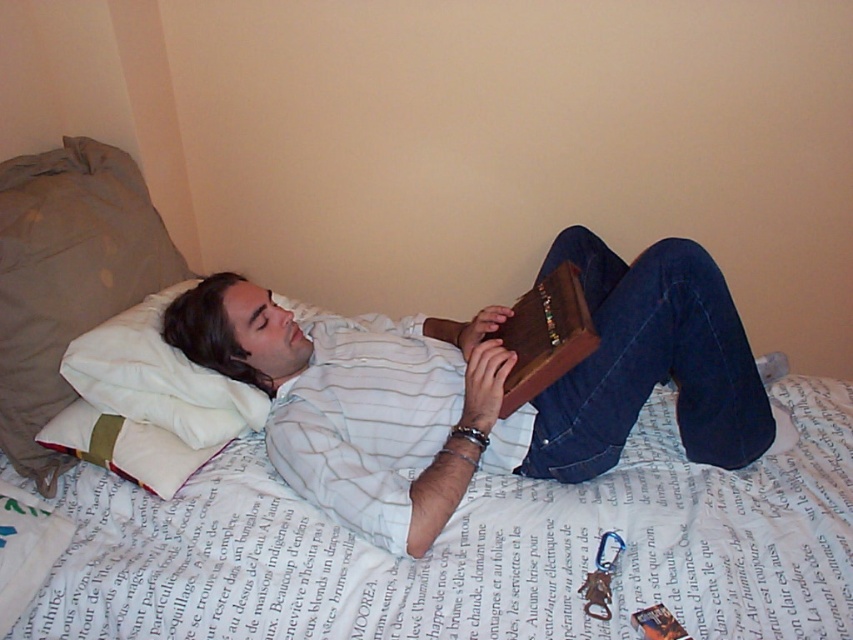
You are a photographer setting up a shot of the scene. You need to position a light source to the left of the white soft pillow at upper left so that it illuminates the matte brown book at center. Based on their positions, will the light hit the book directly or cast a shadow from the pillow onto the book?

The matte brown book at center is to the right of the white soft pillow at upper left. Placing the light source to the left of the white soft pillow at upper left would cast a shadow from the pillow towards the right, which is where the book is located. Therefore, the shadow from the pillow would block some of the light, so the light won

You are designing a bookshelf for the room shown. The matte brown book at center and the white soft pillow at upper left need to be placed on the same shelf. Considering their sizes, which item should be placed first to ensure both fit properly?

The white soft pillow at upper left should be placed first since the matte brown book at center is taller, so positioning the taller item first allows better arrangement to fit both on the shelf.

You are standing in the room and want to place a small lamp between the two points, point 1 at point (349, 321) and point 2 at point (120, 328). Which point should the lamp be closer to in order to be closer to the viewer?

The lamp should be closer to point 1 at point (349, 321) because it is further to the camera than point 2 at point (120, 328).